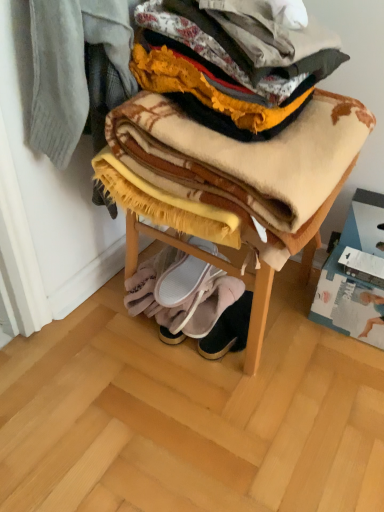
Where is `vacant region to the left of leather suede booties at lower center, the third footwear viewed from the top`? The width and height of the screenshot is (384, 512). vacant region to the left of leather suede booties at lower center, the third footwear viewed from the top is located at coordinates (153, 347).